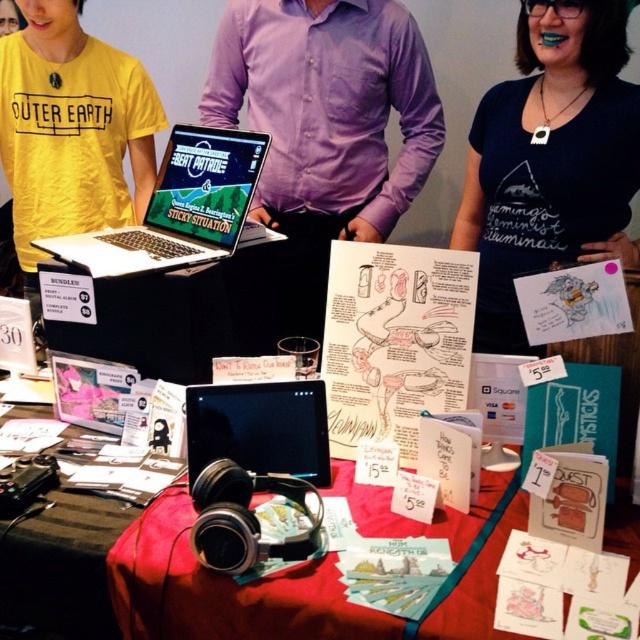
Between black matte headphones at center and black matte tablet at center, which one has more height?

With more height is black matte headphones at center.

I want to click on black matte headphones at center, so click(x=308, y=573).

Locate an element on the screen. The height and width of the screenshot is (640, 640). black matte headphones at center is located at coordinates (308, 573).

Who is more forward, (244, 307) or (476, 564)?

Point (476, 564)

Can you confirm if purple cotton shirt at center is smaller than black matte headphones at center?

Incorrect, purple cotton shirt at center is not smaller in size than black matte headphones at center.

At what (x,y) coordinates should I click in order to perform the action: click on purple cotton shirt at center. Please return your answer as a coordinate pair (x, y). This screenshot has width=640, height=640. Looking at the image, I should click on point(320,141).

Which is in front, point (484, 262) or point (499, 538)?

Point (499, 538)

Locate an element on the screen. This screenshot has width=640, height=640. matte blue t-shirt at center is located at coordinates (550, 161).

Locate an element on the screen. matte blue t-shirt at center is located at coordinates (550, 161).